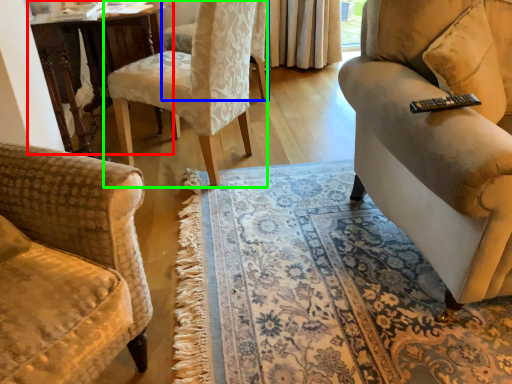
Question: Which object is the farthest from table (highlighted by a red box)? Choose among these: chair (highlighted by a blue box) or chair (highlighted by a green box).

Choices:
 (A) chair
 (B) chair

Answer: (A)